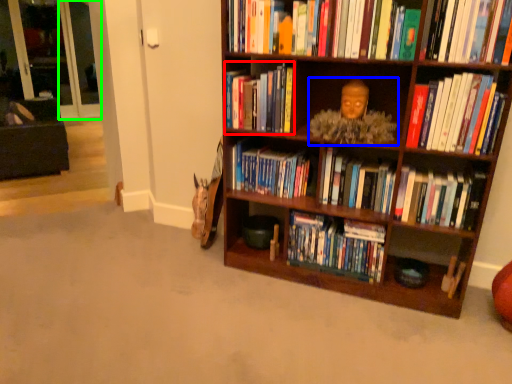
Question: Which object is the farthest from book (highlighted by a red box)? Choose among these: person (highlighted by a blue box) or glass door (highlighted by a green box).

Choices:
 (A) person
 (B) glass door

Answer: (B)